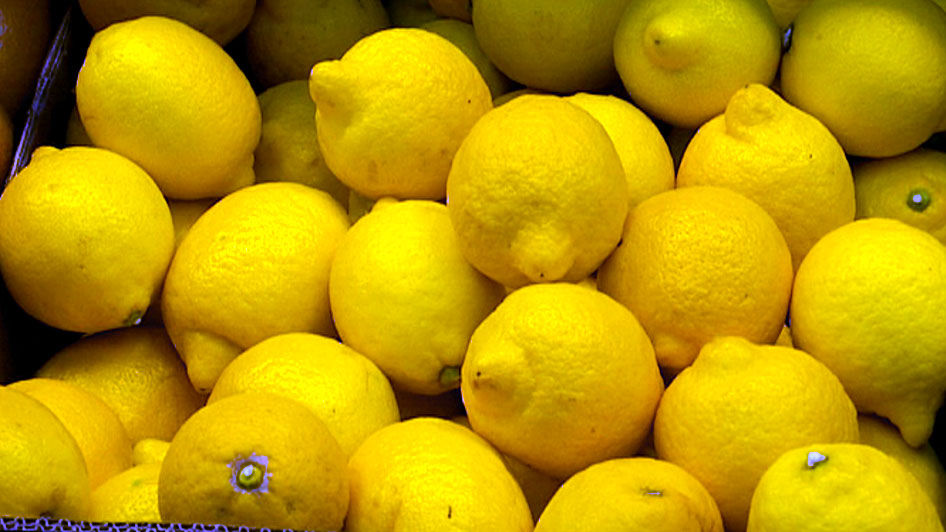
Image resolution: width=946 pixels, height=532 pixels. Identify the location of cardboard box. (57, 523), (30, 128).